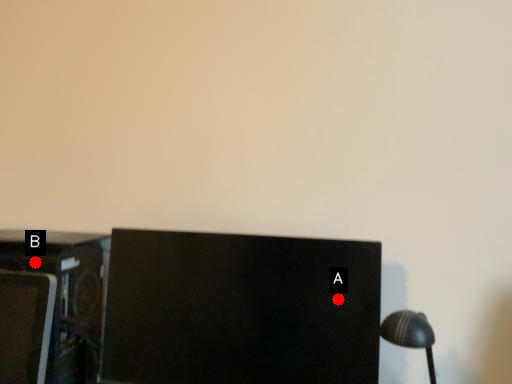
Question: Two points are circled on the image, labeled by A and B beside each circle. Which point is closer to the camera?

Choices:
 (A) A is closer
 (B) B is closer

Answer: (A)